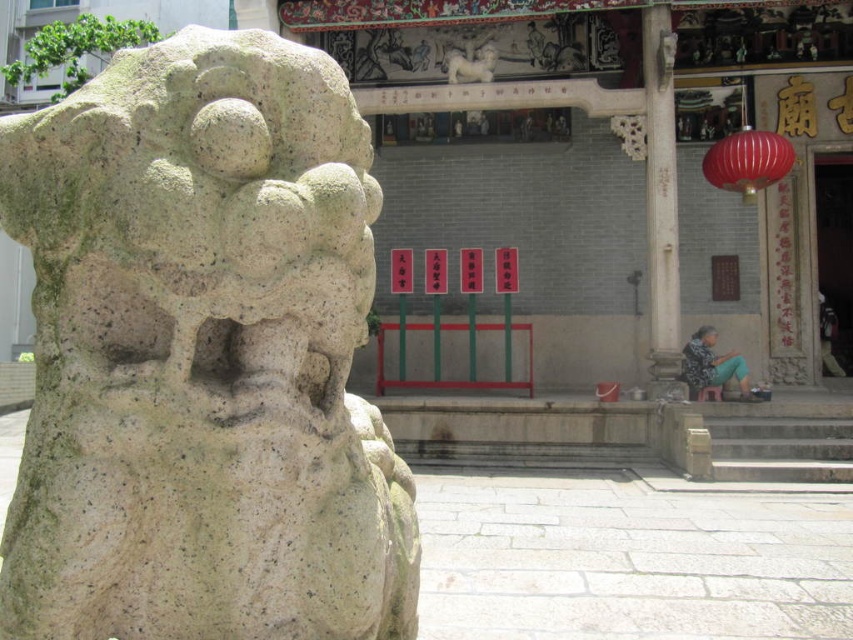
Question: Does granite stone lion at left appear over white stone pillar at upper right?

Choices:
 (A) no
 (B) yes

Answer: (A)

Question: Which of the following is the farthest from the observer?

Choices:
 (A) tap(770, 141)
 (B) tap(490, 80)
 (C) tap(281, 563)

Answer: (B)

Question: Is granite stone lion at left in front of white stone pillar at upper right?

Choices:
 (A) no
 (B) yes

Answer: (B)

Question: Which object appears closest to the camera in this image?

Choices:
 (A) shiny red paper lantern at upper right
 (B) granite stone lion at left
 (C) white stone pillar at upper right

Answer: (B)

Question: Which point is farther to the camera?

Choices:
 (A) shiny red paper lantern at upper right
 (B) white stone lion at upper center
 (C) white stone pillar at upper right

Answer: (B)

Question: Is shiny red paper lantern at upper right positioned before white stone lion at upper center?

Choices:
 (A) no
 (B) yes

Answer: (B)